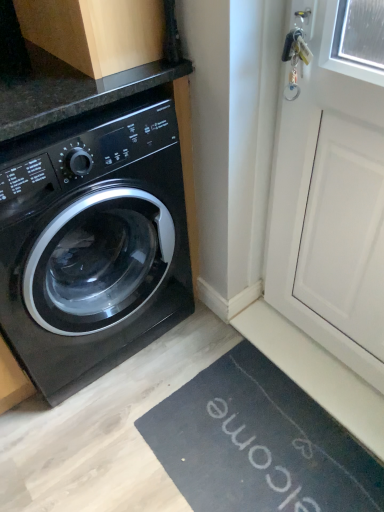
Question: Can you confirm if black rubber bath mat at lower right is shorter than wooden cabinet at upper left?

Choices:
 (A) no
 (B) yes

Answer: (B)

Question: From a real-world perspective, is black rubber bath mat at lower right beneath wooden cabinet at upper left?

Choices:
 (A) no
 (B) yes

Answer: (B)

Question: From the image's perspective, is black rubber bath mat at lower right beneath wooden cabinet at upper left?

Choices:
 (A) yes
 (B) no

Answer: (A)

Question: Considering the relative sizes of black rubber bath mat at lower right and wooden cabinet at upper left in the image provided, is black rubber bath mat at lower right wider than wooden cabinet at upper left?

Choices:
 (A) no
 (B) yes

Answer: (B)

Question: Is black rubber bath mat at lower right positioned far away from wooden cabinet at upper left?

Choices:
 (A) no
 (B) yes

Answer: (B)

Question: Can you confirm if black rubber bath mat at lower right is smaller than wooden cabinet at upper left?

Choices:
 (A) yes
 (B) no

Answer: (A)

Question: Can you confirm if black rubber bath mat at lower right is positioned to the right of black glossy washing machine at left?

Choices:
 (A) no
 (B) yes

Answer: (B)

Question: Can you confirm if black rubber bath mat at lower right is taller than black glossy washing machine at left?

Choices:
 (A) no
 (B) yes

Answer: (A)

Question: Is black rubber bath mat at lower right in contact with black glossy washing machine at left?

Choices:
 (A) no
 (B) yes

Answer: (A)

Question: Considering the relative positions of black rubber bath mat at lower right and black glossy washing machine at left in the image provided, is black rubber bath mat at lower right to the left of black glossy washing machine at left from the viewer's perspective?

Choices:
 (A) yes
 (B) no

Answer: (B)

Question: Considering the relative positions of black rubber bath mat at lower right and black glossy washing machine at left in the image provided, is black rubber bath mat at lower right behind black glossy washing machine at left?

Choices:
 (A) yes
 (B) no

Answer: (A)

Question: From a real-world perspective, is black rubber bath mat at lower right under black glossy washing machine at left?

Choices:
 (A) no
 (B) yes

Answer: (B)

Question: From the image's perspective, is wooden cabinet at upper left below black glossy washing machine at left?

Choices:
 (A) no
 (B) yes

Answer: (A)